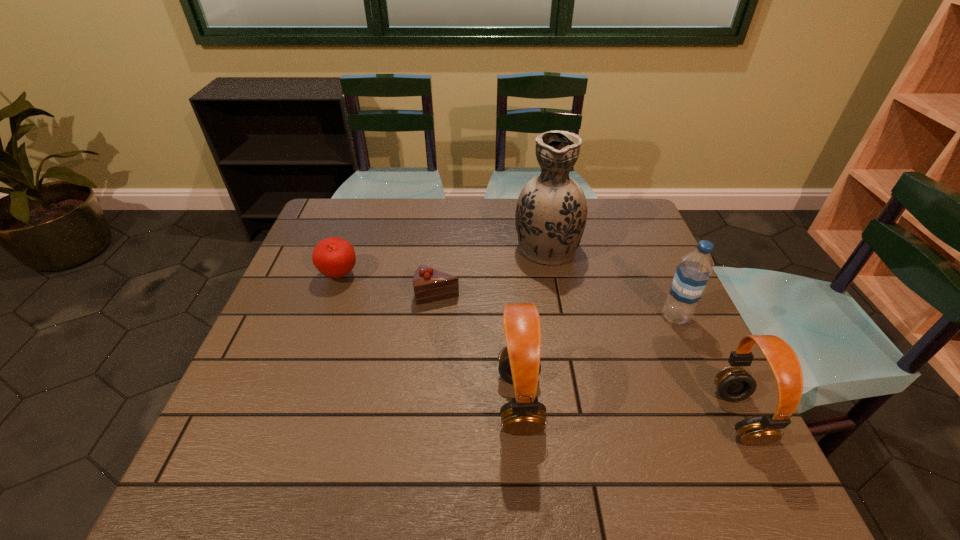
Locate an element on the screen. empty space that is in between the right headset and the shortest object is located at coordinates (588, 355).

Locate an element on the screen. The height and width of the screenshot is (540, 960). vacant point located between the chocolate cake and the third nearest object is located at coordinates (557, 305).

The height and width of the screenshot is (540, 960). I want to click on vacant region between the leftmost object and the fourth farthest object, so click(508, 296).

Where is `empty space between the second shortest object and the vase`? This screenshot has height=540, width=960. empty space between the second shortest object and the vase is located at coordinates (443, 261).

Identify the location of free spot between the fifth object from right to left and the right headset. (588, 355).

I want to click on vacant space in between the shorter headset and the tallest object, so click(x=642, y=332).

Identify which object is located as the nearest to the taller headset. Please provide its 2D coordinates. Your answer should be formatted as a tuple, i.e. [(x, y)], where the tuple contains the x and y coordinates of a point satisfying the conditions above.

[(429, 284)]

Choose which object is the third nearest neighbor to the water bottle. Please provide its 2D coordinates. Your answer should be formatted as a tuple, i.e. [(x, y)], where the tuple contains the x and y coordinates of a point satisfying the conditions above.

[(519, 364)]